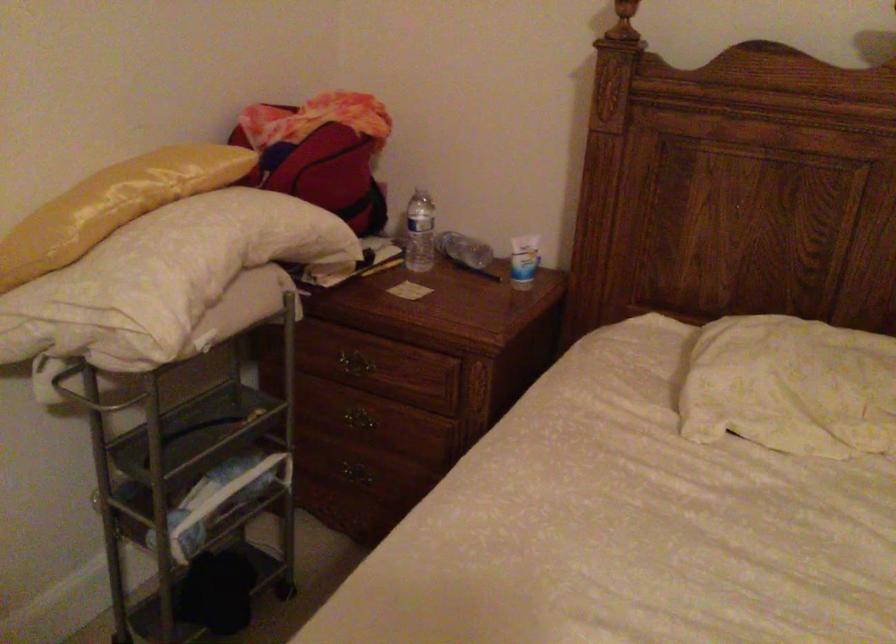
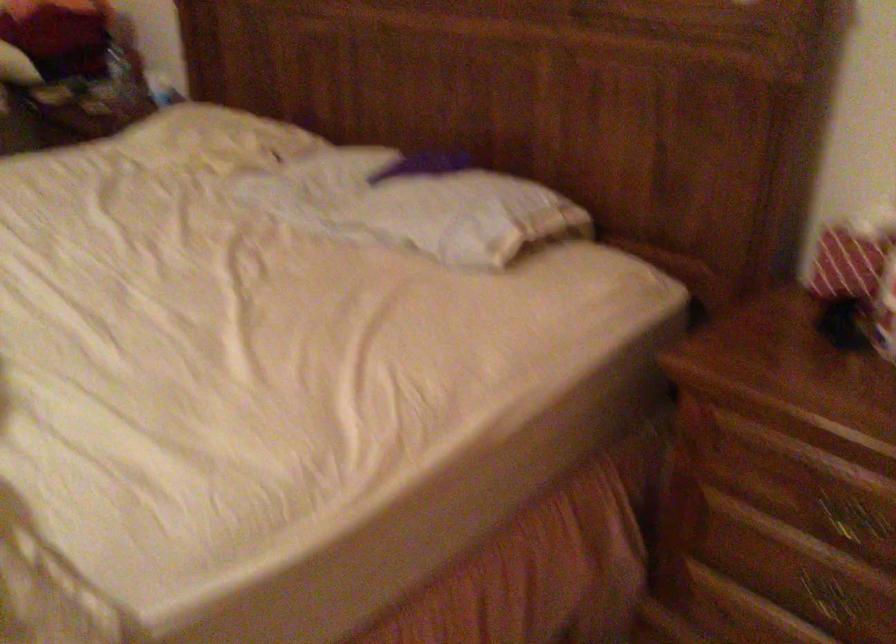
In a continuous first-person perspective shot, in which direction is the camera moving?

The movement direction of the cameraman is right, backward.